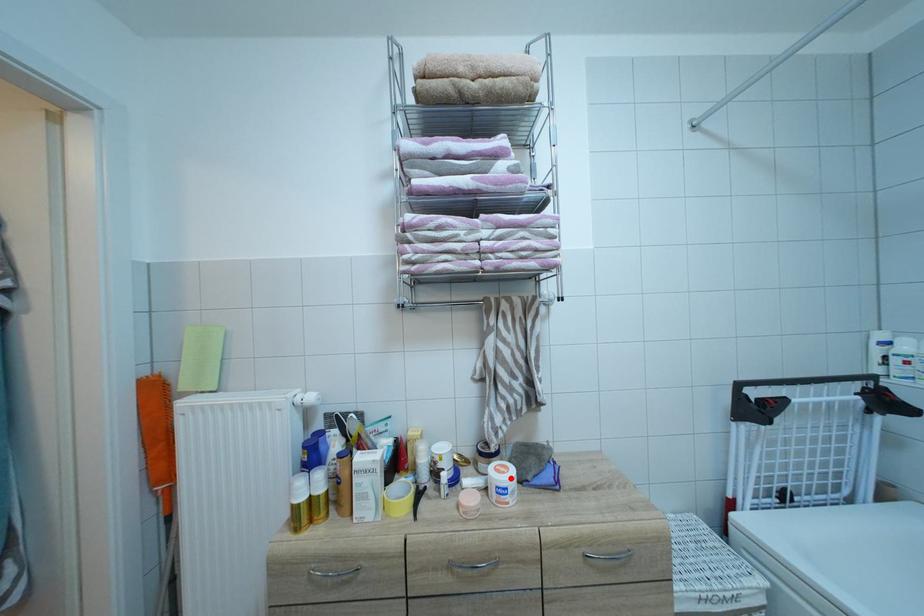
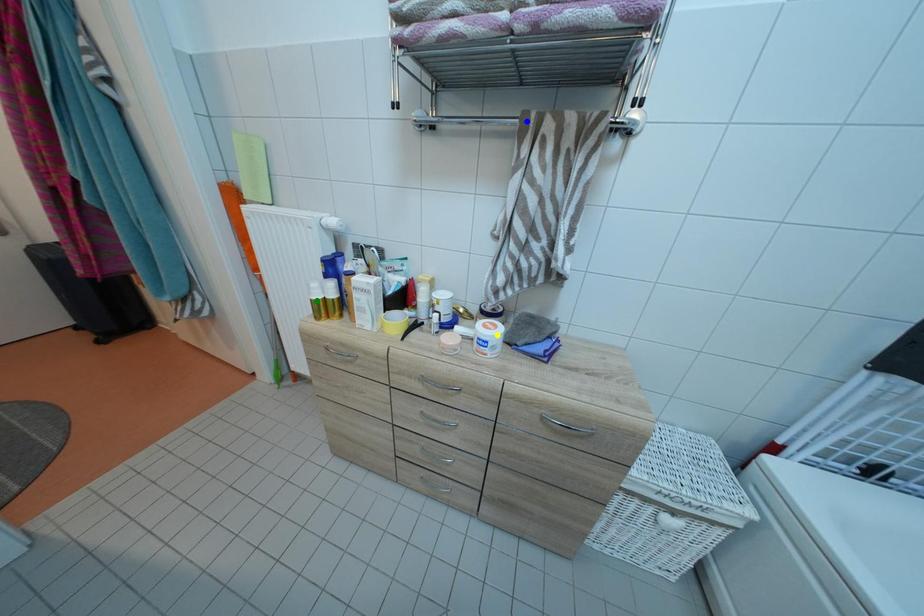
Question: I am providing you with two images of the same scene from different viewpoints. A red point is marked on the first image. You are given multiple points on the second image. Which point in image 2 represents the same 3d spot as the red point in image 1?

Choices:
 (A) green point
 (B) yellow point
 (C) blue point

Answer: (B)